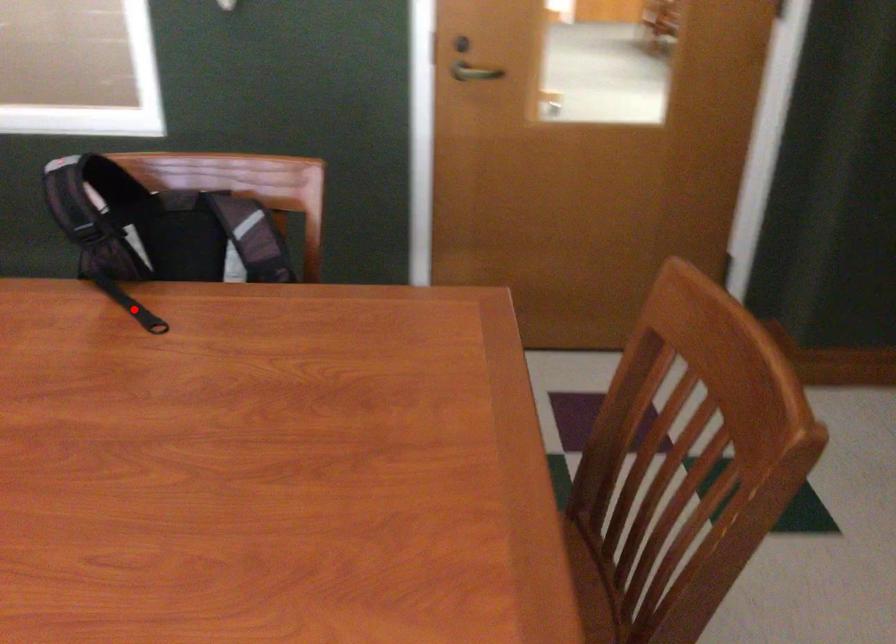
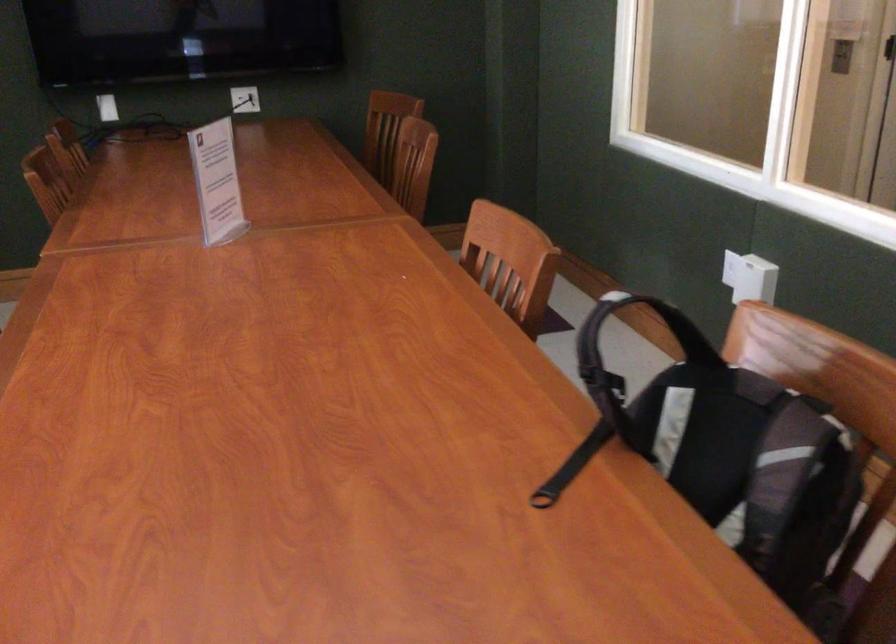
Question: I am providing you with two images of the same scene from different viewpoints. In image1, a red point is highlighted. Considering the same 3D point in image2, which of the following is correct?

Choices:
 (A) It is closer
 (B) It is farther

Answer: (A)